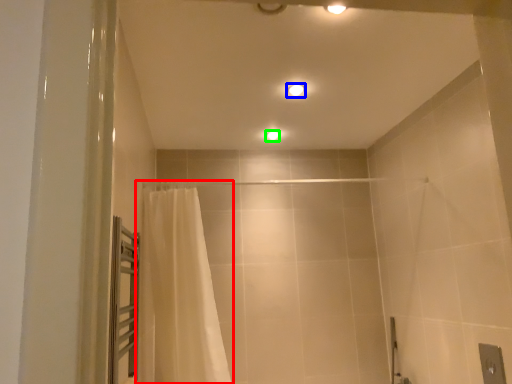
Question: Estimate the real-world distances between objects in this image. Which object is closer to curtain (highlighted by a red box), light fixture (highlighted by a blue box) or light fixture (highlighted by a green box)?

Choices:
 (A) light fixture
 (B) light fixture

Answer: (A)